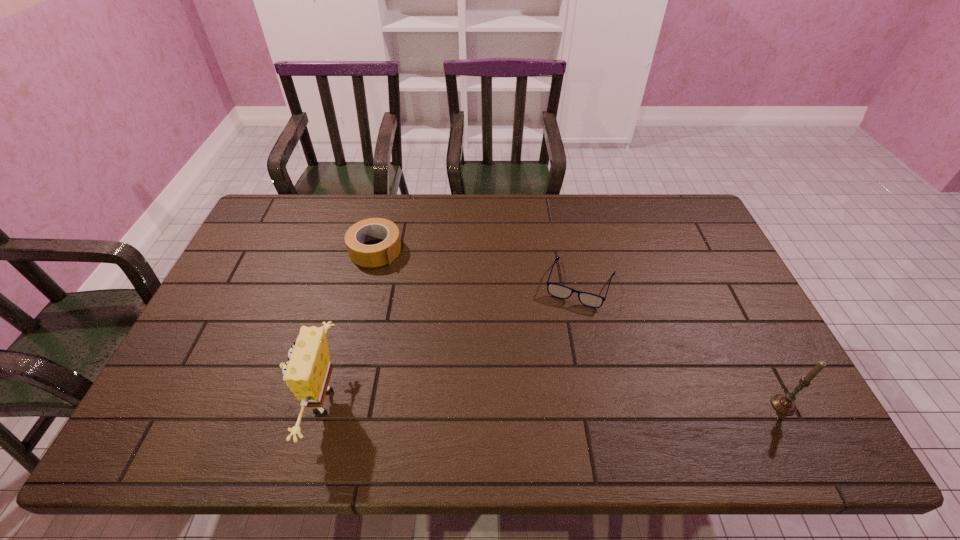
In order to click on sponge in this screenshot , I will do `click(307, 373)`.

Identify the location of the rightmost object. This screenshot has width=960, height=540. (784, 404).

Image resolution: width=960 pixels, height=540 pixels. I want to click on the third shortest object, so click(784, 404).

At what (x,y) coordinates should I click in order to perform the action: click on the shortest object. Please return your answer as a coordinate pair (x, y). Looking at the image, I should click on (559, 291).

Find the location of a particular element. spectacles is located at coordinates (559, 291).

Where is `duct tape`? The image size is (960, 540). duct tape is located at coordinates (380, 254).

Locate an element on the screen. The height and width of the screenshot is (540, 960). vacant space located 0.290m on the face of the tallest object is located at coordinates (180, 403).

Where is `vacant area situated on the face of the tallest object`? Image resolution: width=960 pixels, height=540 pixels. vacant area situated on the face of the tallest object is located at coordinates (159, 403).

This screenshot has width=960, height=540. In order to click on vacant region located on the face of the tallest object in this screenshot , I will do `click(218, 403)`.

This screenshot has width=960, height=540. I want to click on vacant space situated on the left of the rightmost object, so click(x=625, y=404).